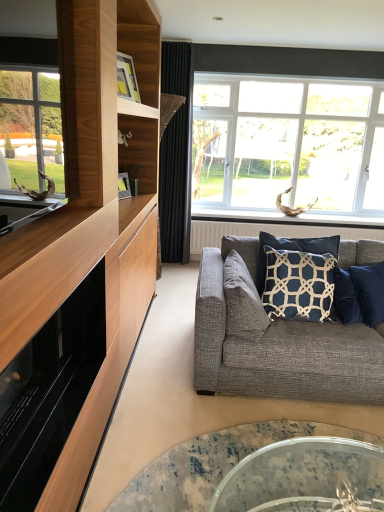
Question: In the image, is dark blue fabric pillow at center, which is counted as the second pillow, starting from the left, positioned in front of or behind matte black fireplace at left?

Choices:
 (A) behind
 (B) front

Answer: (A)

Question: In terms of width, does dark blue fabric pillow at center, which is counted as the second pillow, starting from the left, look wider or thinner when compared to matte black fireplace at left?

Choices:
 (A) wide
 (B) thin

Answer: (B)

Question: Estimate the real-world distances between objects in this image. Which object is closer to the translucent glass coffee table at lower center?

Choices:
 (A) white plastic window at upper right
 (B) dark blue fabric pillow at center, which is counted as the second pillow, starting from the left
 (C) black velvet curtain at center
 (D) textured gray pillow at center, the 1th pillow viewed from the left
 (E) textured gray couch at lower right

Answer: (E)

Question: Which is farther from the dark blue fabric pillow at center, which is counted as the second pillow, starting from the left?

Choices:
 (A) textured gray couch at lower right
 (B) black velvet curtain at center
 (C) translucent glass coffee table at lower center
 (D) white textured radiator at center
 (E) matte black fireplace at left

Answer: (B)